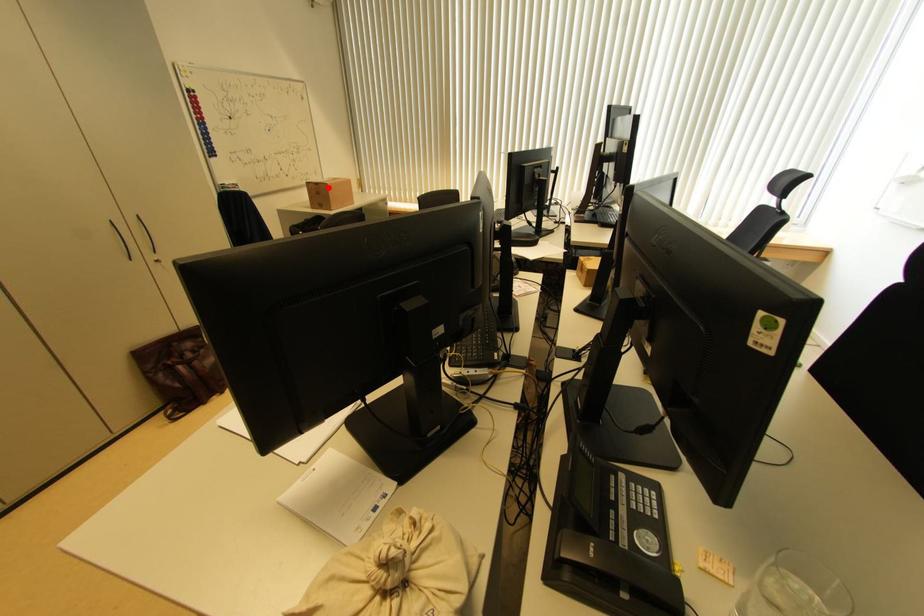
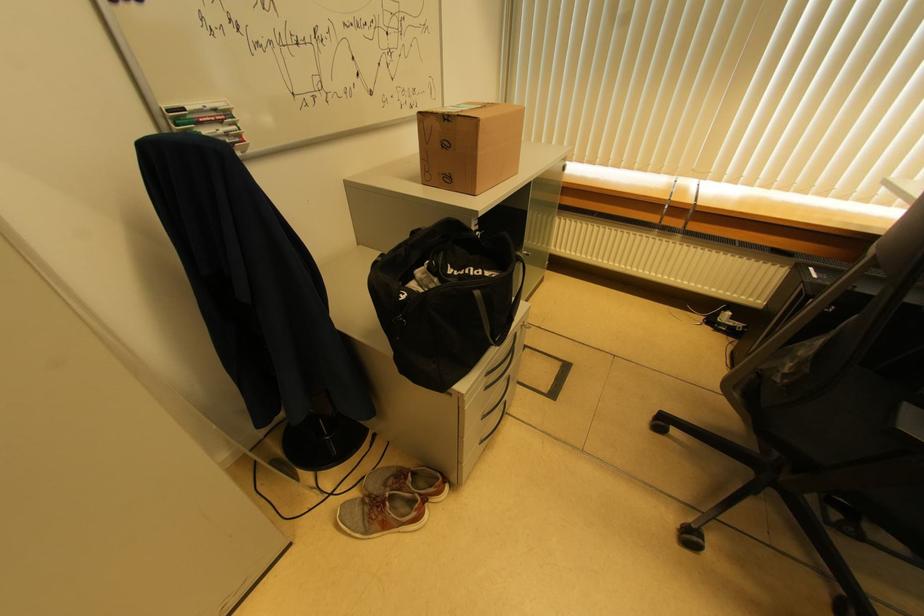
Question: I am providing you with two images of the same scene from different viewpoints. Given a red point in image1, look at the same physical point in image2. Is it:

Choices:
 (A) Closer to the viewpoint
 (B) Farther from the viewpoint

Answer: (B)